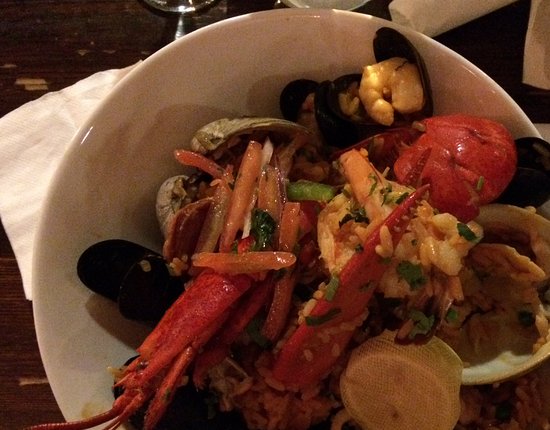
I want to click on napkin, so click(53, 150).